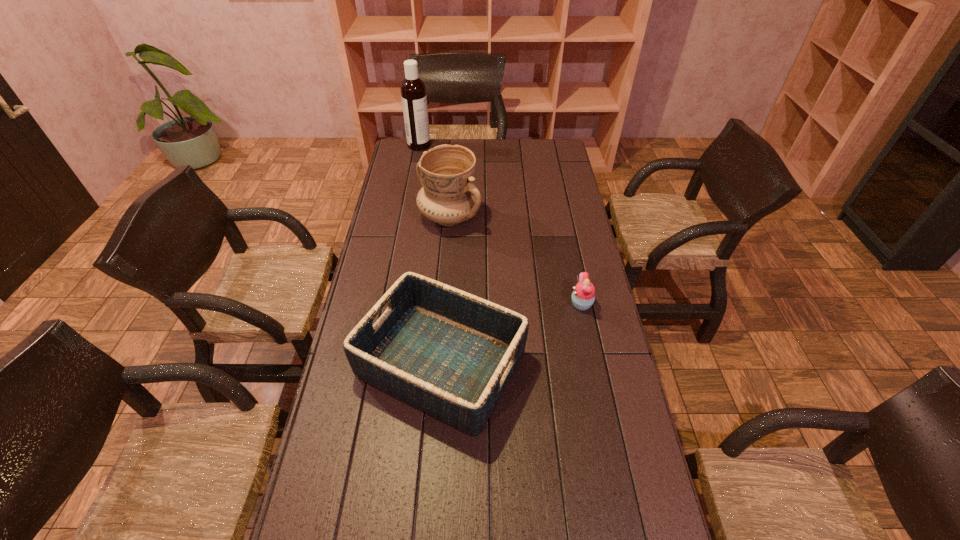
Locate an element on the screen. The image size is (960, 540). vacant space that satisfies the following two spatial constraints: 1. on the label side of the pottery; 2. on the left side of the tallest object is located at coordinates (406, 217).

Locate an element on the screen. vacant space that satisfies the following two spatial constraints: 1. on the label side of the pottery; 2. on the left side of the dishwasher detergent is located at coordinates (406, 217).

This screenshot has width=960, height=540. I want to click on vacant space that satisfies the following two spatial constraints: 1. on the label side of the basket; 2. on the left side of the tallest object, so click(378, 364).